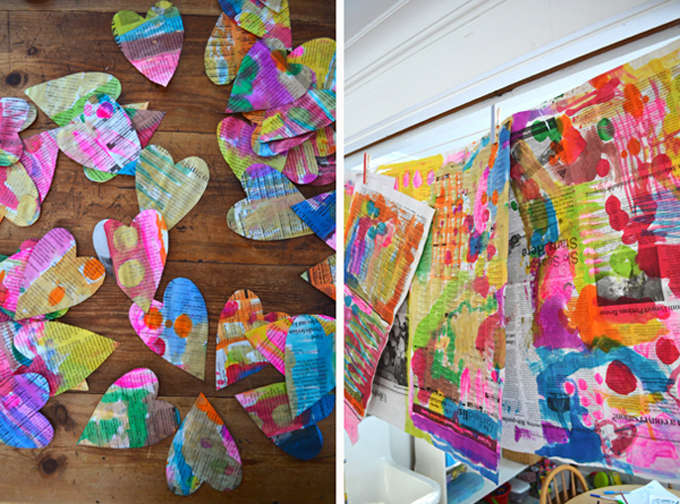
You are a GUI agent. You are given a task and a screenshot of the screen. Output one action in this format:
    pyautogui.click(x=<x>, y=<y>)
    Task: Click on the chair
    The height and width of the screenshot is (504, 680).
    Given the screenshot: What is the action you would take?
    pyautogui.click(x=558, y=491)